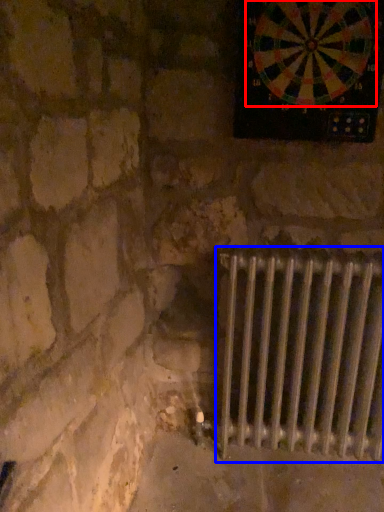
Question: Among these objects, which one is nearest to the camera, wheel (highlighted by a red box) or radiator (highlighted by a blue box)?

Choices:
 (A) wheel
 (B) radiator

Answer: (A)